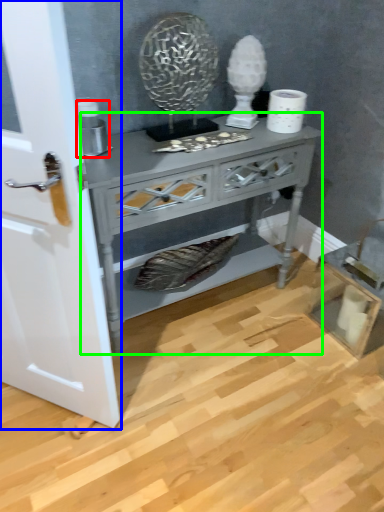
Question: Based on their relative distances, which object is farther from appliance (highlighted by a red box)? Choose from door (highlighted by a blue box) and nightstand (highlighted by a green box).

Choices:
 (A) door
 (B) nightstand

Answer: (A)